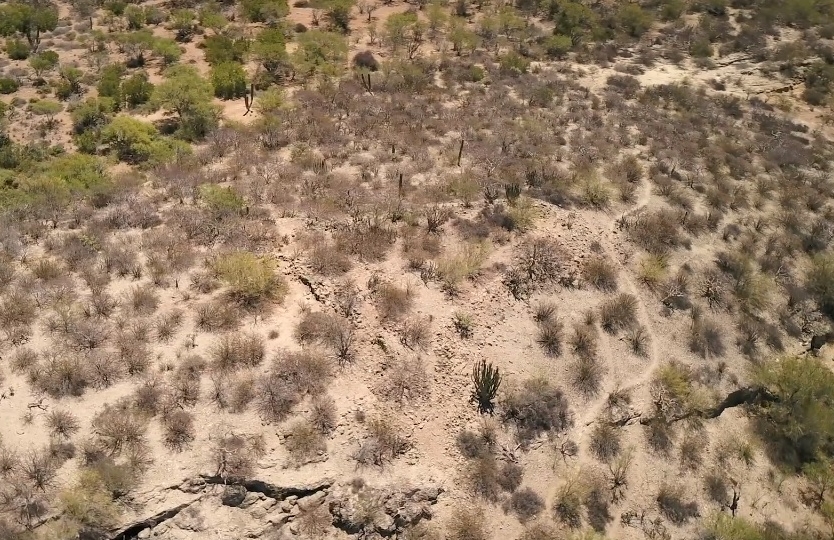
Locate an element on the screen. dried up plant is located at coordinates (481, 387).